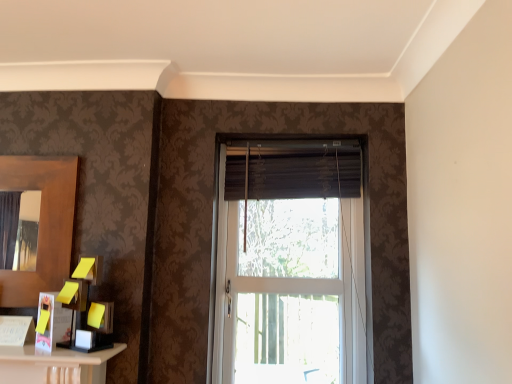
What do you see at coordinates (290, 265) in the screenshot? The width and height of the screenshot is (512, 384). I see `white glass window at center` at bounding box center [290, 265].

Identify the location of brown wooden mirror at left. (42, 224).

Where is `white glass window at center`? The height and width of the screenshot is (384, 512). white glass window at center is located at coordinates (290, 265).

Is brown wooden mirror at left further to camera compared to white glass window at center?

No, brown wooden mirror at left is closer to the camera.

Which of these two, brown wooden mirror at left or white glass window at center, is thinner?

brown wooden mirror at left is thinner.

What's the angular difference between brown wooden mirror at left and white glass window at center's facing directions?

The angular difference between brown wooden mirror at left and white glass window at center is 0.583 degrees.

Is white glass window at center positioned with its back to dark brown fabric curtain at center?

That's right, white glass window at center is facing away from dark brown fabric curtain at center.

Based on their sizes in the image, would you say white glass window at center is bigger or smaller than dark brown fabric curtain at center?

white glass window at center is bigger than dark brown fabric curtain at center.

How different are the orientations of white glass window at center and dark brown fabric curtain at center in degrees?

The angular difference between white glass window at center and dark brown fabric curtain at center is 0.0011 degrees.

Which is less distant, (248,271) or (315,186)?

The point (315,186) is in front.

Is dark brown fabric curtain at center taller than brown wooden mirror at left?

Incorrect, the height of dark brown fabric curtain at center is not larger of that of brown wooden mirror at left.

Which object is more forward, dark brown fabric curtain at center or brown wooden mirror at left?

brown wooden mirror at left is more forward.

Are dark brown fabric curtain at center and brown wooden mirror at left beside each other?

No, dark brown fabric curtain at center is not making contact with brown wooden mirror at left.

How different are the orientations of dark brown fabric curtain at center and brown wooden mirror at left in degrees?

0.583 degrees.

Could you tell me if brown wooden mirror at left is turned towards dark brown fabric curtain at center?

No, brown wooden mirror at left is not facing towards dark brown fabric curtain at center.

In the scene shown: From a real-world perspective, is brown wooden mirror at left physically located above or below dark brown fabric curtain at center?

brown wooden mirror at left is below dark brown fabric curtain at center.

Considering the relative sizes of brown wooden mirror at left and dark brown fabric curtain at center in the image provided, is brown wooden mirror at left taller than dark brown fabric curtain at center?

Yes, brown wooden mirror at left is taller than dark brown fabric curtain at center.

Would you say brown wooden mirror at left is a long distance from dark brown fabric curtain at center?

They are positioned close to each other.

From a real-world perspective, between dark brown fabric curtain at center and white glass window at center, who is vertically lower?

white glass window at center, from a real-world perspective.

Between dark brown fabric curtain at center and white glass window at center, which one appears on the right side from the viewer's perspective?

From the viewer's perspective, white glass window at center appears more on the right side.

Are dark brown fabric curtain at center and white glass window at center making contact?

dark brown fabric curtain at center and white glass window at center are clearly separated.

From the image's perspective, which object appears higher, white glass window at center or brown wooden mirror at left?

brown wooden mirror at left is shown above in the image.

Is white glass window at center looking in the opposite direction of brown wooden mirror at left?

white glass window at center is not turned away from brown wooden mirror at left.

Which object is further away from the camera taking this photo, white glass window at center or brown wooden mirror at left?

white glass window at center is further away from the camera.

At what (x,y) coordinates should I click in order to perform the action: click on window that is below the brown wooden mirror at left (from the image's perspective). Please return your answer as a coordinate pair (x, y). The height and width of the screenshot is (384, 512). Looking at the image, I should click on (290, 265).

You are a GUI agent. You are given a task and a screenshot of the screen. Output one action in this format:
    pyautogui.click(x=<x>, y=<y>)
    Task: Click on the curtain above the white glass window at center (from the image's perspective)
    
    Given the screenshot: What is the action you would take?
    pyautogui.click(x=304, y=176)

Estimate the real-world distances between objects in this image. Which object is closer to white glass window at center, brown wooden mirror at left or dark brown fabric curtain at center?

The object closer to white glass window at center is dark brown fabric curtain at center.

Based on their spatial positions, is white glass window at center or brown wooden mirror at left closer to dark brown fabric curtain at center?

The object closer to dark brown fabric curtain at center is white glass window at center.

In the scene shown: Considering their positions, is white glass window at center positioned further to brown wooden mirror at left than dark brown fabric curtain at center?

Among the two, white glass window at center is located further to brown wooden mirror at left.

Which object lies further to the anchor point white glass window at center, dark brown fabric curtain at center or brown wooden mirror at left?

The object further to white glass window at center is brown wooden mirror at left.

When comparing their distances from dark brown fabric curtain at center, does brown wooden mirror at left or white glass window at center seem further?

Based on the image, brown wooden mirror at left appears to be further to dark brown fabric curtain at center.

Estimate the real-world distances between objects in this image. Which object is closer to brown wooden mirror at left, dark brown fabric curtain at center or white glass window at center?

dark brown fabric curtain at center.

Find the location of a particular element. This screenshot has width=512, height=384. curtain between brown wooden mirror at left and white glass window at center is located at coordinates (304, 176).